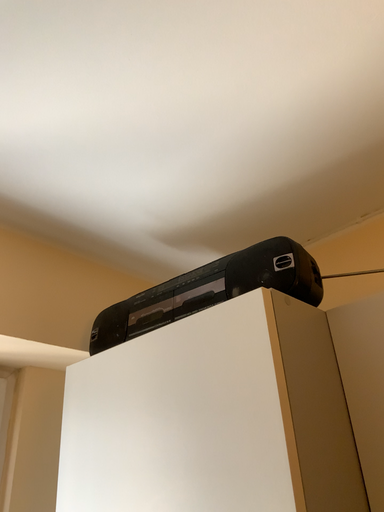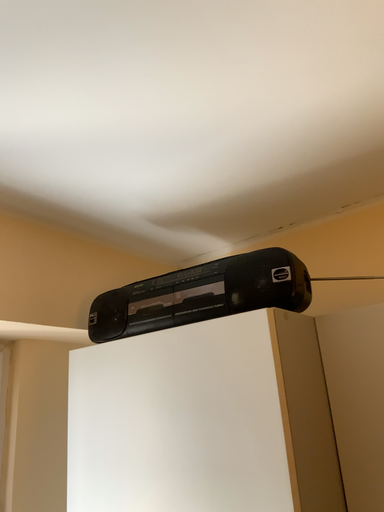
Question: Which way did the camera rotate in the video?

Choices:
 (A) rotated downward
 (B) rotated upward

Answer: (A)